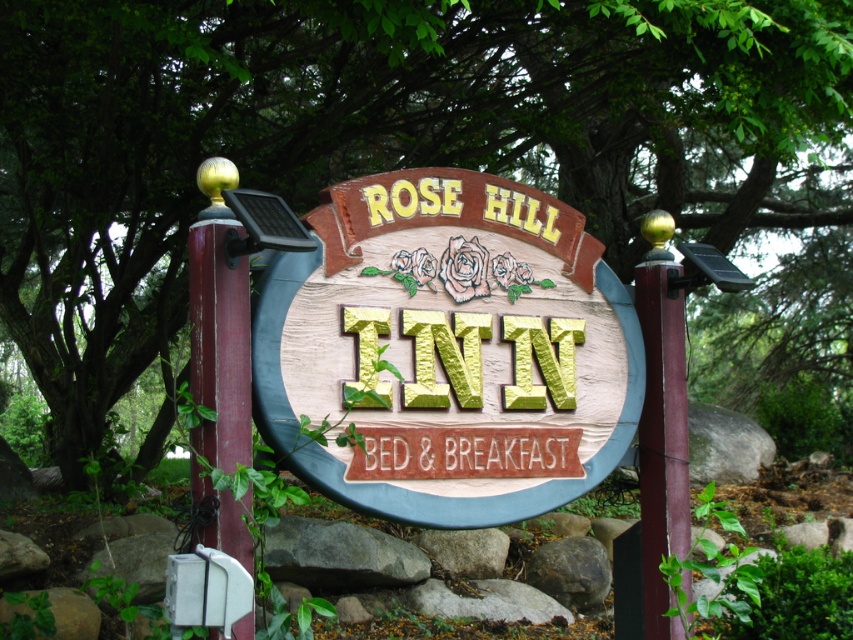
You are standing in front of the Rose Hill Inn Bed and Breakfast sign. There is a point at coordinates point (448, 349). Where is this point located on the sign?

The point (448, 349) is on the wooden sign at center.

You are standing in front of the Rose Hill Inn Bed and Breakfast. You want to locate the wooden sign at center. Where should you look relative to the entrance?

The wooden sign at center is located at point (448, 349), which is centrally positioned in front of the entrance.

You are standing in front of the Rose Hill Inn Bed and Breakfast sign. There is a point at coordinates (448, 349). What object is located at this point?

The point at (448, 349) indicates the wooden sign at center.